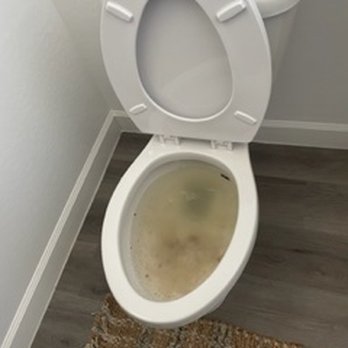
Locate an element on the screen. The height and width of the screenshot is (348, 348). under side of toilet seat is located at coordinates (226, 132).